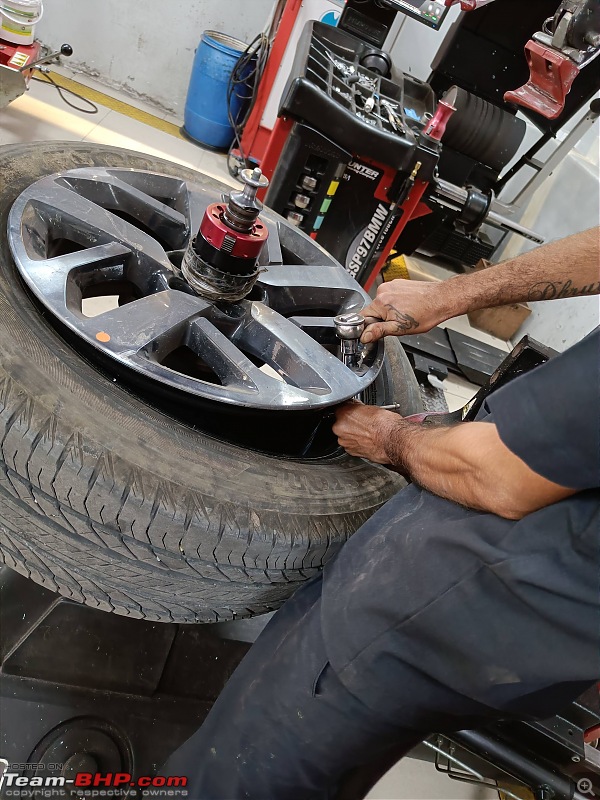
The width and height of the screenshot is (600, 800). Identify the location of floor. [94, 126].